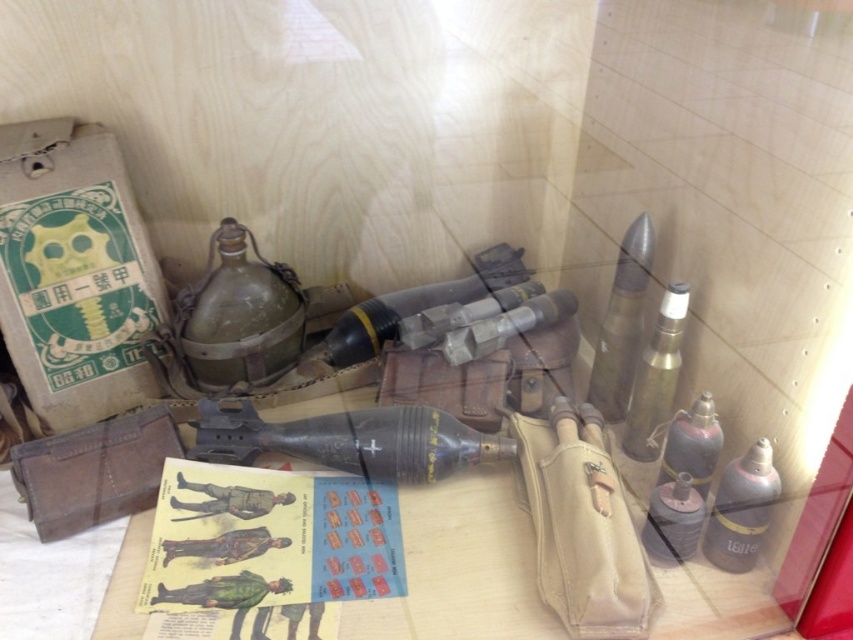
From the picture: Who is positioned more to the right, green matte canteen at center-left or matte black rocket at center?

matte black rocket at center is more to the right.

Is green matte canteen at center-left in front of matte black rocket at center?

Yes.

Identify the location of green matte canteen at center-left. This screenshot has width=853, height=640. (239, 314).

The image size is (853, 640). Identify the location of green matte canteen at center-left. (239, 314).

Which of these two, black rubber grenade at center or matte black bottle at lower right, stands shorter?

Standing shorter between the two is black rubber grenade at center.

Is black rubber grenade at center bigger than matte black bottle at lower right?

Yes.

Describe the element at coordinates (349, 440) in the screenshot. I see `black rubber grenade at center` at that location.

The image size is (853, 640). What are the coordinates of `black rubber grenade at center` in the screenshot? It's located at (349, 440).

Where is `black rubber grenade at center`? black rubber grenade at center is located at coordinates (349, 440).

Can you confirm if black rubber grenade at center is bigger than metallic silver bullet at upper right?

No, black rubber grenade at center is not bigger than metallic silver bullet at upper right.

This screenshot has height=640, width=853. Identify the location of black rubber grenade at center. (349, 440).

You are a GUI agent. You are given a task and a screenshot of the screen. Output one action in this format:
    pyautogui.click(x=<x>, y=<y>)
    Task: Click on the black rubber grenade at center
    
    Given the screenshot: What is the action you would take?
    pyautogui.click(x=349, y=440)